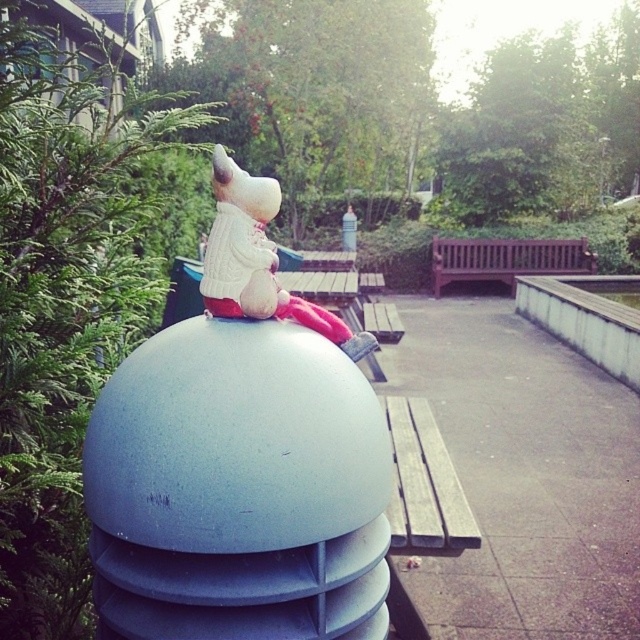
Can you confirm if white plush toy at center is shorter than wooden bench at right?

No.

Who is more distant from viewer, (230, 218) or (394, 518)?

Point (394, 518)

This screenshot has height=640, width=640. What do you see at coordinates (259, 260) in the screenshot? I see `white plush toy at center` at bounding box center [259, 260].

The width and height of the screenshot is (640, 640). In order to click on white plush toy at center in this screenshot , I will do `click(259, 260)`.

Is point (266, 308) positioned after point (548, 268)?

No, it is in front of (548, 268).

Between white plush toy at center and brown wooden bench at center, which one has more height?

brown wooden bench at center is taller.

Is point (228, 216) farther from viewer compared to point (481, 266)?

No, (228, 216) is in front of (481, 266).

Locate an element on the screen. white plush toy at center is located at coordinates (259, 260).

Between point (464, 500) and point (522, 257), which one is positioned behind?

The point (522, 257) is behind.

Between wooden bench at right and brown wooden bench at center, which one appears on the right side from the viewer's perspective?

brown wooden bench at center is more to the right.

Which is behind, point (403, 476) or point (444, 262)?

The point (444, 262) is behind.

The image size is (640, 640). In order to click on wooden bench at right in this screenshot , I will do `click(424, 483)`.